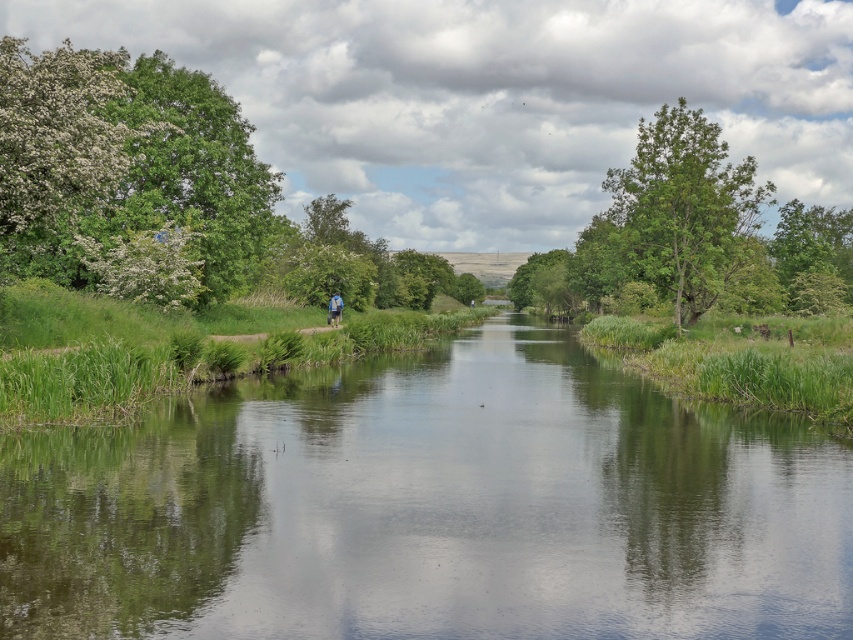
Question: Which of the following is the closest to the observer?

Choices:
 (A) green leafy tree at right
 (B) green grassy stream at center
 (C) blue fabric backpack at center

Answer: (B)

Question: Among these objects, which one is nearest to the camera?

Choices:
 (A) blue fabric backpack at center
 (B) green grassy stream at center

Answer: (B)

Question: Among these objects, which one is nearest to the camera?

Choices:
 (A) blue fabric backpack at center
 (B) green leafy tree at right

Answer: (B)

Question: Is green grassy stream at center positioned behind blue fabric backpack at center?

Choices:
 (A) no
 (B) yes

Answer: (A)

Question: Considering the relative positions of green leafy tree at right and blue fabric backpack at center in the image provided, where is green leafy tree at right located with respect to blue fabric backpack at center?

Choices:
 (A) right
 (B) left

Answer: (A)

Question: Is green grassy stream at center above blue fabric backpack at center?

Choices:
 (A) no
 (B) yes

Answer: (A)